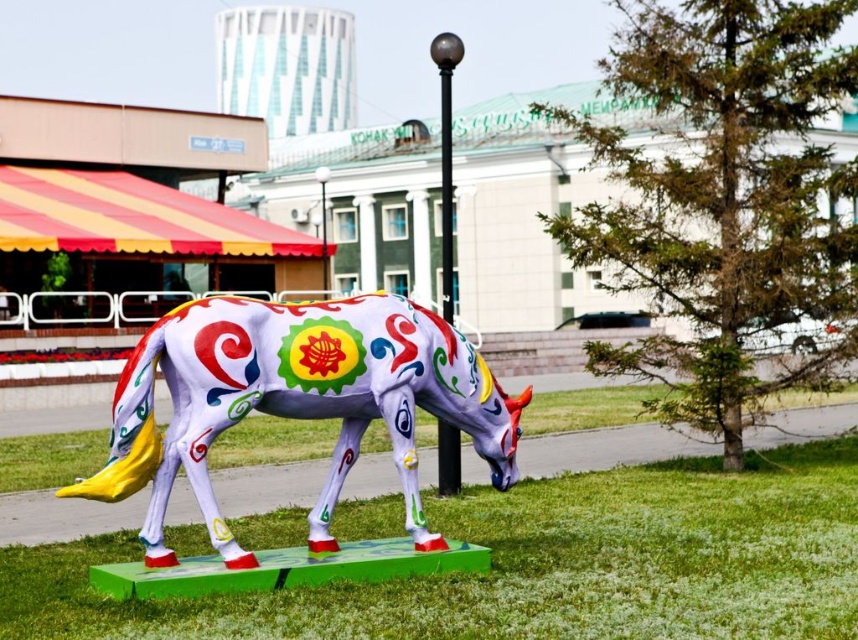
Question: In this image, where is green grass at center located relative to painted ceramic horse at center?

Choices:
 (A) below
 (B) above

Answer: (A)

Question: Which point is closer to the camera?

Choices:
 (A) (325, 348)
 (B) (742, 506)

Answer: (A)

Question: Is green grass at center to the right of painted ceramic horse at center from the viewer's perspective?

Choices:
 (A) no
 (B) yes

Answer: (B)

Question: Can you confirm if green grass at center is bigger than painted ceramic horse at center?

Choices:
 (A) no
 (B) yes

Answer: (A)